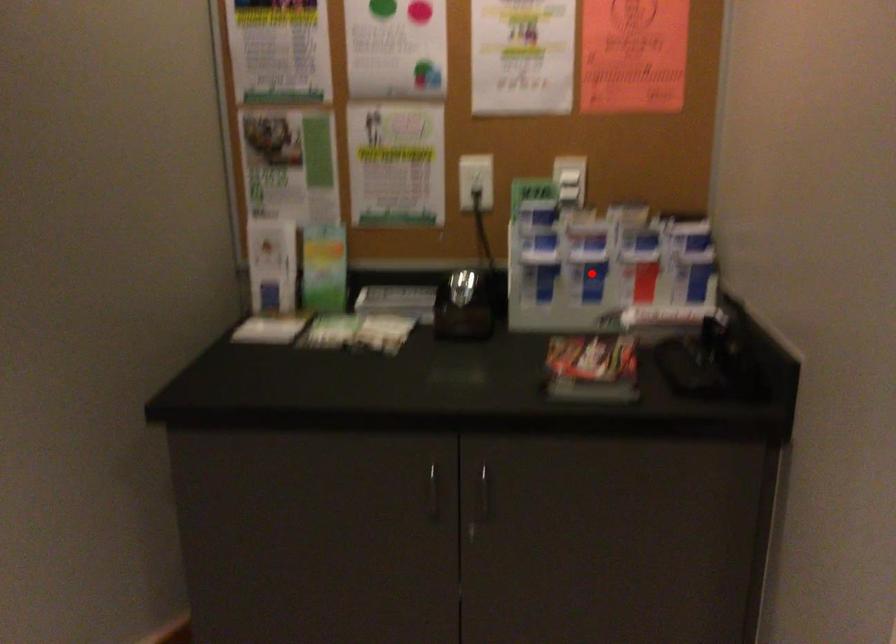
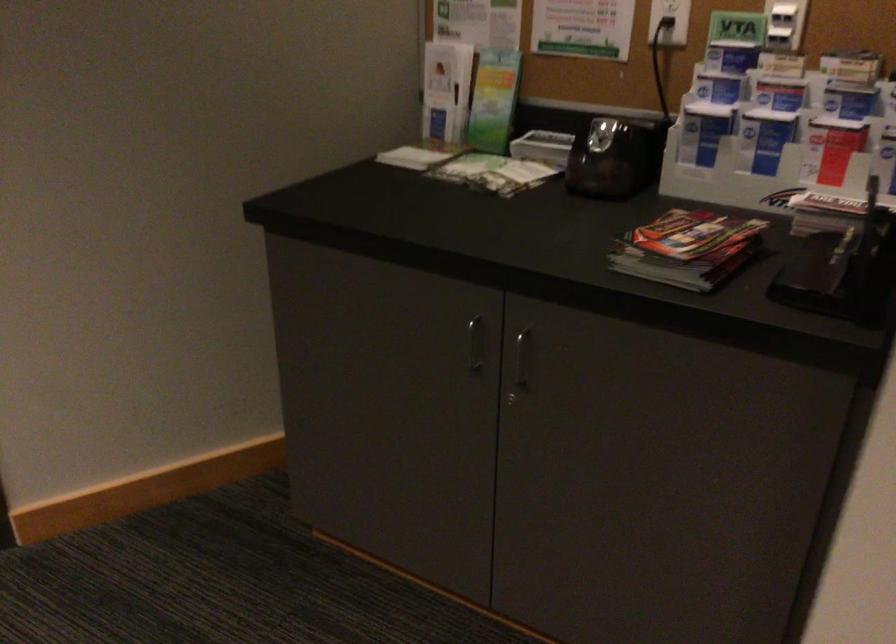
Question: A red point is marked in image1. In image2, is the corresponding 3D point closer to the camera or farther? Reply with the corresponding letter.

Choices:
 (A) The corresponding 3D point is closer.
 (B) The corresponding 3D point is farther.

Answer: (A)